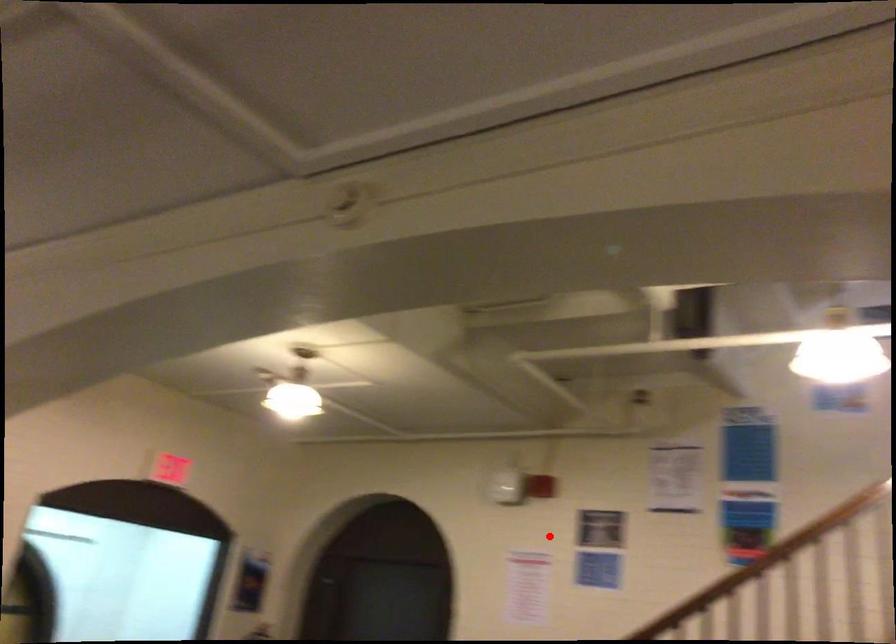
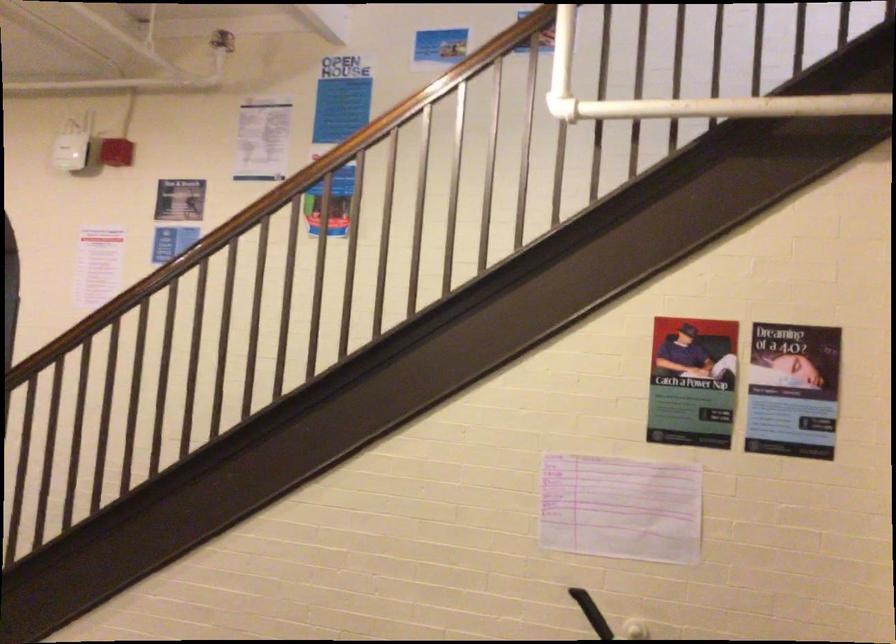
Question: I am providing you with two images of the same scene from different viewpoints. A red point is shown in image1. For the corresponding object point in image2, is it positioned nearer or farther from the camera?

Choices:
 (A) Nearer
 (B) Farther

Answer: (A)